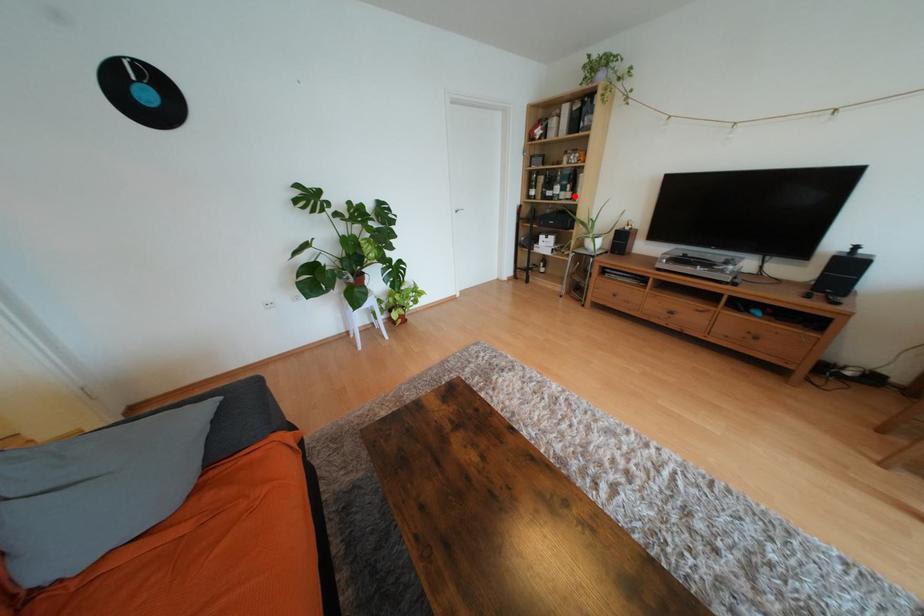
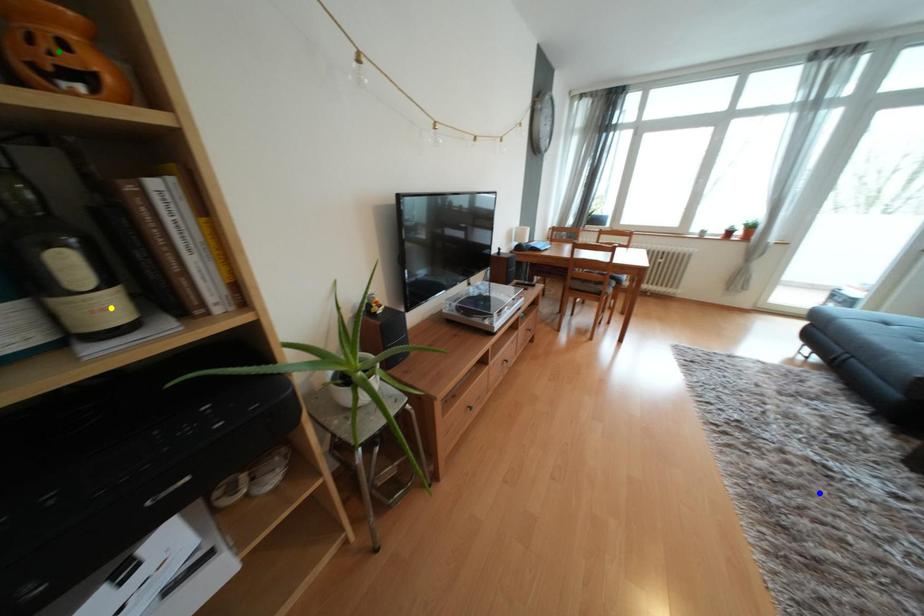
Question: I am providing you with two images of the same scene from different viewpoints. A red point is marked on the first image. You are given multiple points on the second image. Which spot in image 2 lines up with the point in image 1?

Choices:
 (A) yellow point
 (B) blue point
 (C) green point

Answer: (A)